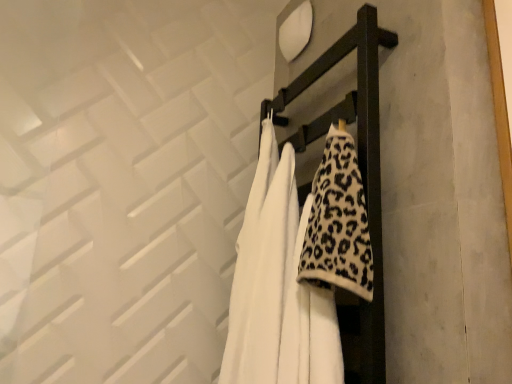
Question: Should I look upward or downward to see leopard print fleece blanket at center?

Choices:
 (A) up
 (B) down

Answer: (B)